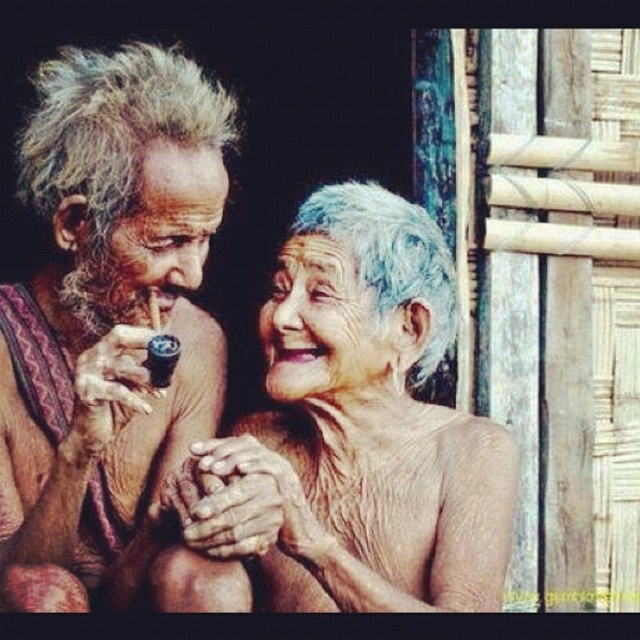
Does brown textured cloth at left appear under gray textured hair at center?

No, brown textured cloth at left is not below gray textured hair at center.

This screenshot has height=640, width=640. What do you see at coordinates (108, 314) in the screenshot?
I see `brown textured cloth at left` at bounding box center [108, 314].

In order to click on brown textured cloth at left in this screenshot , I will do `click(108, 314)`.